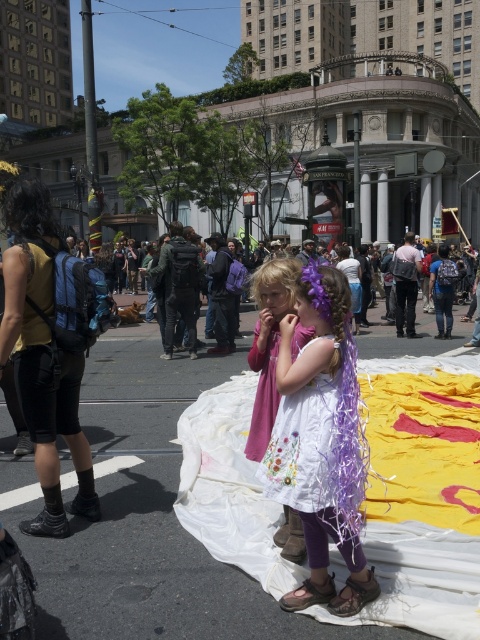
Question: Which of the following is the farthest from the observer?

Choices:
 (A) purple fabric dress at center
 (B) white satin dress at center

Answer: (A)

Question: Which of the following is the closest to the observer?

Choices:
 (A) (72, 346)
 (B) (272, 404)
 (C) (303, 483)
 (D) (277, 349)

Answer: (C)

Question: Can you confirm if white satin dress at center is thinner than white cotton dress at center?

Choices:
 (A) yes
 (B) no

Answer: (B)

Question: Does white fabric at center have a larger size compared to white satin dress at center?

Choices:
 (A) yes
 (B) no

Answer: (B)

Question: Which object is positioned farthest from the purple fabric dress at center?

Choices:
 (A) white fabric at center
 (B) yellow sleeveless top at left
 (C) white cotton dress at center
 (D) white embroidered dress at center

Answer: (A)

Question: Does white fabric at center have a lesser width compared to purple fabric dress at center?

Choices:
 (A) yes
 (B) no

Answer: (B)